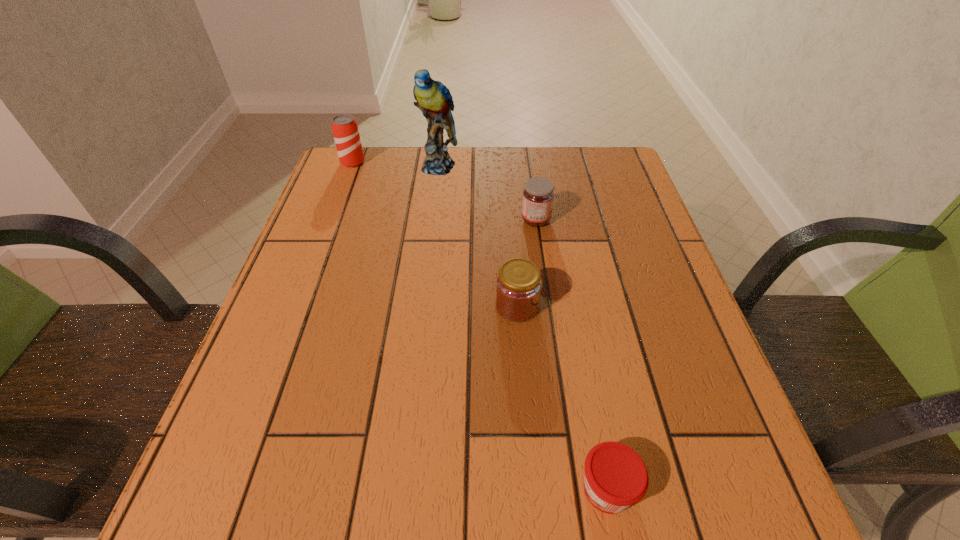
Locate an element on the screen. This screenshot has width=960, height=540. vacant space located on the right of the farthest jam is located at coordinates coord(630,220).

Where is `free location located on the right of the second farthest jam`? This screenshot has width=960, height=540. free location located on the right of the second farthest jam is located at coordinates (635, 306).

Identify the location of vacant point located on the label side of the nearest object. (398, 489).

Locate an element on the screen. vacant position located on the label side of the nearest object is located at coordinates (384, 489).

Image resolution: width=960 pixels, height=540 pixels. I want to click on free region located on the label side of the nearest object, so click(384, 489).

Where is `parrot at the far edge`? The width and height of the screenshot is (960, 540). parrot at the far edge is located at coordinates (434, 99).

Locate an element on the screen. The height and width of the screenshot is (540, 960). beer can at the far edge is located at coordinates (345, 130).

Identify the location of object present at the near edge. (616, 477).

Where is `object present at the left edge`? This screenshot has width=960, height=540. object present at the left edge is located at coordinates (345, 130).

Locate an element on the screen. Image resolution: width=960 pixels, height=540 pixels. object situated at the far left corner is located at coordinates (345, 130).